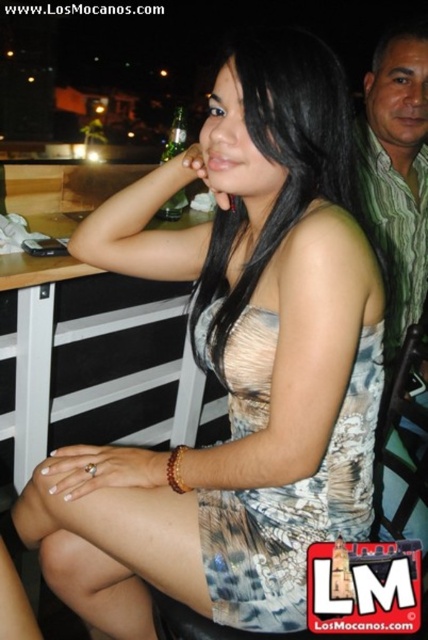
Question: Is printed fabric dress at center positioned in front of green glass bottle at upper center?

Choices:
 (A) yes
 (B) no

Answer: (A)

Question: Is green striped shirt at right to the right of green glass bottle at upper center from the viewer's perspective?

Choices:
 (A) no
 (B) yes

Answer: (B)

Question: Considering the relative positions of green striped shirt at right and green glass bottle at upper center in the image provided, where is green striped shirt at right located with respect to green glass bottle at upper center?

Choices:
 (A) right
 (B) left

Answer: (A)

Question: Which object is the closest to the green glass bottle at upper center?

Choices:
 (A) white wood table at center
 (B) matte beige dress at center
 (C) green striped shirt at right
 (D) printed fabric dress at center

Answer: (A)

Question: Which of the following is the farthest from the observer?

Choices:
 (A) green glass bottle at upper center
 (B) printed fabric dress at center
 (C) white wood table at center
 (D) matte beige dress at center

Answer: (A)

Question: Which of the following is the closest to the observer?

Choices:
 (A) printed fabric dress at center
 (B) white wood table at center
 (C) matte beige dress at center

Answer: (C)